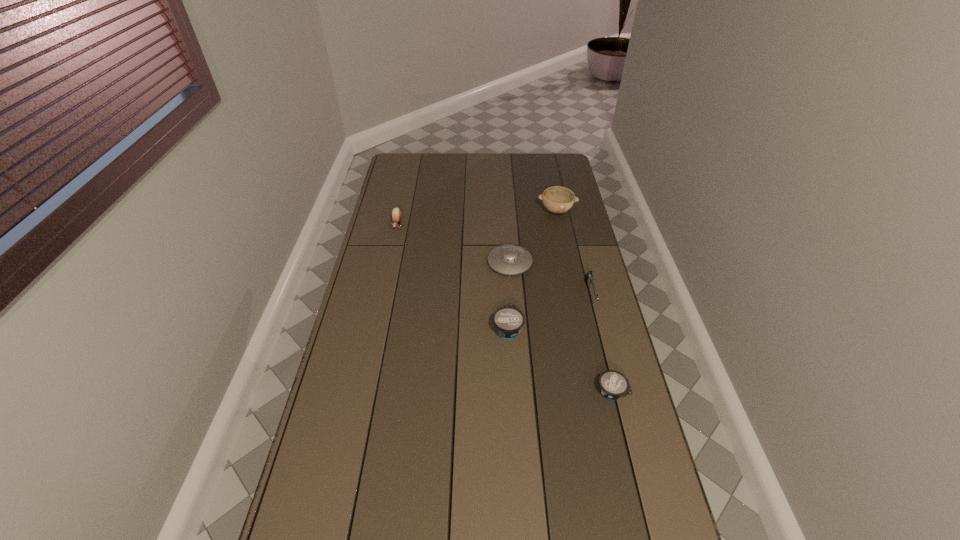
Locate an element on the screen. The width and height of the screenshot is (960, 540). the second nearest object is located at coordinates (508, 320).

Where is `the taller yogurt`? The height and width of the screenshot is (540, 960). the taller yogurt is located at coordinates (508, 320).

Where is `the nearest object`? the nearest object is located at coordinates (613, 385).

The width and height of the screenshot is (960, 540). What are the coordinates of `the nearer yogurt` in the screenshot? It's located at (613, 385).

This screenshot has width=960, height=540. I want to click on saucer, so tap(508, 259).

Image resolution: width=960 pixels, height=540 pixels. In order to click on the leftmost object in this screenshot , I will do `click(396, 212)`.

What are the coordinates of `the tallest object` in the screenshot? It's located at (556, 199).

Locate an element on the screen. Image resolution: width=960 pixels, height=540 pixels. pistol is located at coordinates (589, 277).

I want to click on vacant space located 0.340m on the back of the farther yogurt, so click(x=503, y=252).

Find the location of a particular element. This screenshot has height=540, width=960. vacant space located 0.310m on the front of the right yogurt is located at coordinates (642, 520).